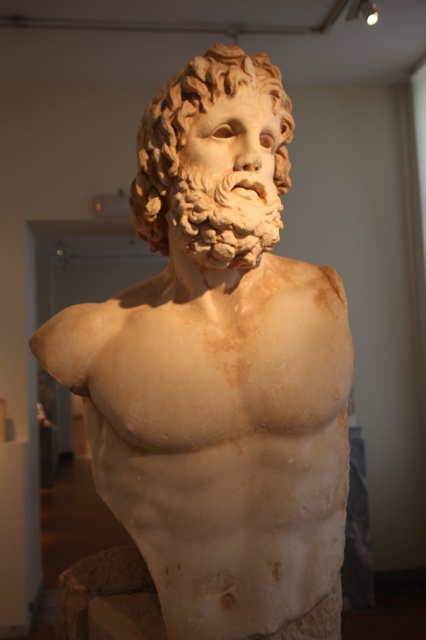
Question: Which of the following is the closest to the observer?

Choices:
 (A) (221, 80)
 (B) (232, 45)

Answer: (A)

Question: Is white marble bust at center smaller than white marble head at center?

Choices:
 (A) no
 (B) yes

Answer: (A)

Question: Observing the image, what is the correct spatial positioning of white marble bust at center in reference to white marble head at center?

Choices:
 (A) below
 (B) above

Answer: (A)

Question: Is white marble bust at center behind white marble head at center?

Choices:
 (A) no
 (B) yes

Answer: (A)